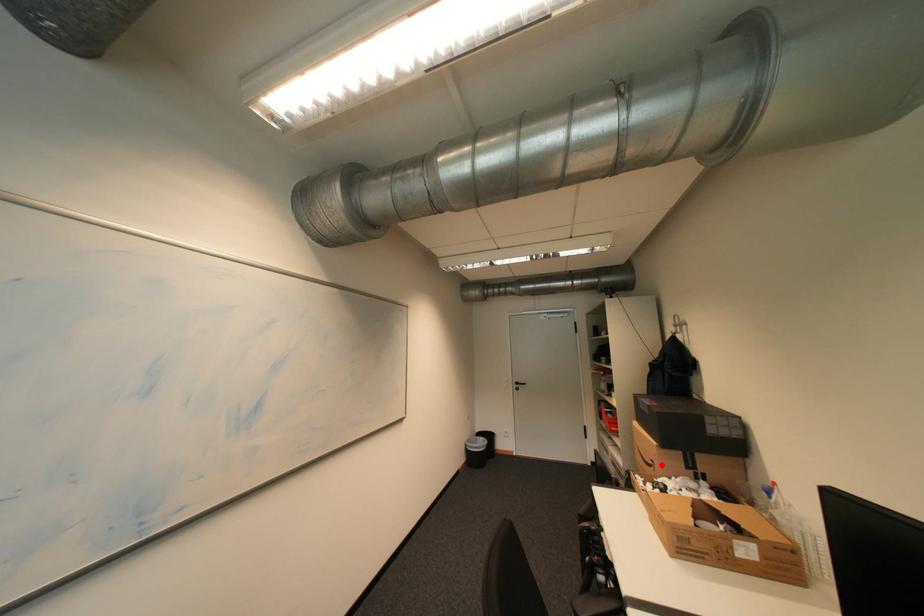
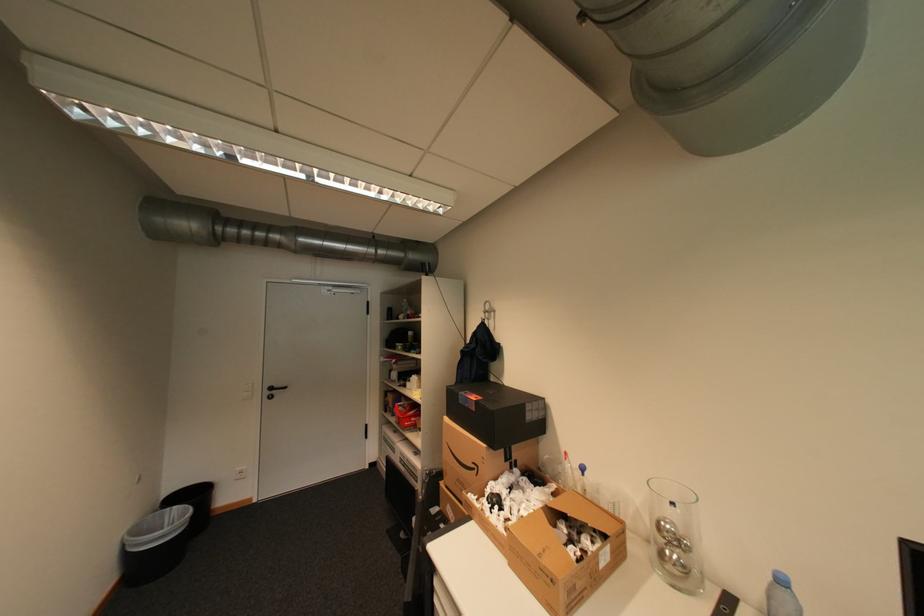
The point at the highlighted location is marked in the first image. Where is the corresponding point in the second image?

(484, 468)